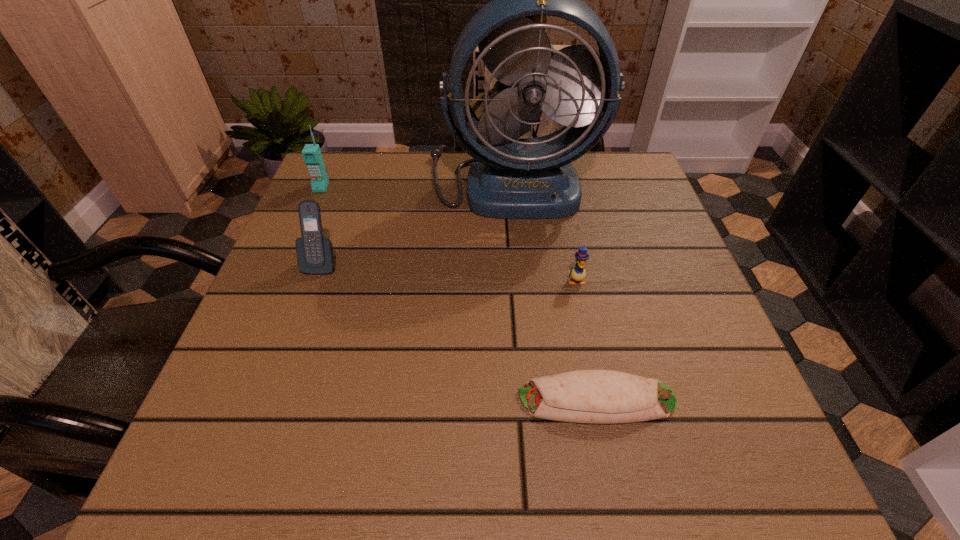
At what (x,y) coordinates should I click in order to perform the action: click on object at the far right corner. Please return your answer as a coordinate pair (x, y). Looking at the image, I should click on (513, 178).

Locate an element on the screen. free space at the far edge is located at coordinates (387, 165).

Image resolution: width=960 pixels, height=540 pixels. What are the coordinates of `vacant space at the near edge of the desktop` in the screenshot? It's located at (506, 456).

You are a GUI agent. You are given a task and a screenshot of the screen. Output one action in this format:
    pyautogui.click(x=<x>, y=<y>)
    Task: Click on the vacant space at the left edge of the desktop
    This screenshot has width=960, height=540.
    Given the screenshot: What is the action you would take?
    pyautogui.click(x=296, y=229)

In the image, there is a desktop. Where is `blank space at the right edge`? This screenshot has width=960, height=540. blank space at the right edge is located at coordinates (640, 249).

The width and height of the screenshot is (960, 540). In the image, there is a desktop. Identify the location of vacant space at the far left corner. (332, 159).

The width and height of the screenshot is (960, 540). What are the coordinates of `blank space at the far right corner of the desktop` in the screenshot? It's located at (599, 194).

Locate an element on the screen. This screenshot has height=540, width=960. unoccupied area between the fourth tallest object and the fourth object from right to left is located at coordinates (448, 272).

Locate an element on the screen. empty space that is in between the tallest object and the third shortest object is located at coordinates (417, 222).

You are a GUI agent. You are given a task and a screenshot of the screen. Output one action in this format:
    pyautogui.click(x=<x>, y=<y>)
    Task: Click on the vacant space in between the fan and the shorter cellular telephone
    The height and width of the screenshot is (540, 960).
    Given the screenshot: What is the action you would take?
    pyautogui.click(x=417, y=222)